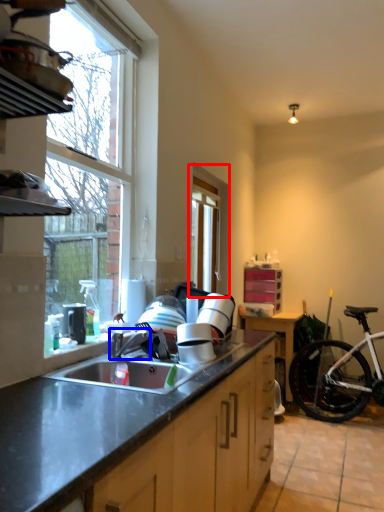
Question: Which object appears closest to the camera in this image, window (highlighted by a red box) or faucet (highlighted by a blue box)?

Choices:
 (A) window
 (B) faucet

Answer: (B)